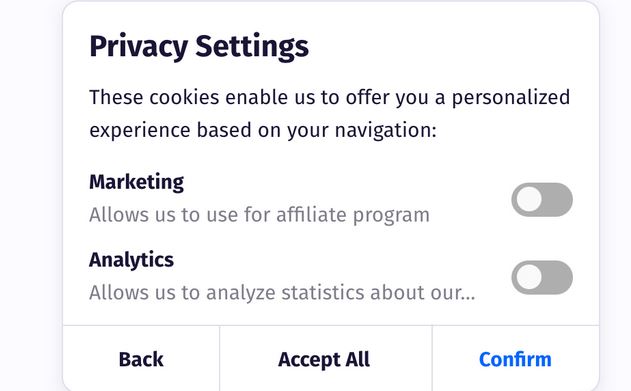
Find the location of a particular element. The image size is (631, 391). gray on/off buttons is located at coordinates (551, 196), (551, 277).